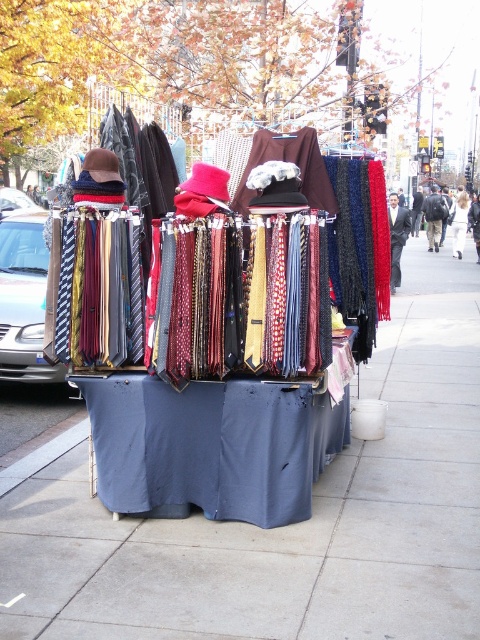
Who is higher up, velvet burgundy tie at center or black leather backpack at center?

Positioned higher is black leather backpack at center.

Who is more forward, [399,266] or [442,216]?

Positioned in front is point [399,266].

This screenshot has height=640, width=480. What do you see at coordinates (396, 237) in the screenshot? I see `velvet burgundy tie at center` at bounding box center [396, 237].

Identify the location of velvet burgundy tie at center. (396, 237).

Is point (436, 524) behind point (452, 225)?

No, (436, 524) is in front of (452, 225).

Is smooth concrete pavement at center to the left of white fabric at center from the viewer's perspective?

Yes, smooth concrete pavement at center is to the left of white fabric at center.

Is point (175, 538) closer to viewer compared to point (462, 227)?

Yes, point (175, 538) is closer to viewer.

Locate an element on the screen. smooth concrete pavement at center is located at coordinates (290, 524).

Is gray concrete curb at lower left to the right of black leather backpack at center from the viewer's perspective?

In fact, gray concrete curb at lower left is to the left of black leather backpack at center.

Between gray concrete curb at lower left and black leather backpack at center, which one is positioned higher?

black leather backpack at center is higher up.

Where is `gray concrete curb at lower left`? This screenshot has width=480, height=640. gray concrete curb at lower left is located at coordinates (44, 451).